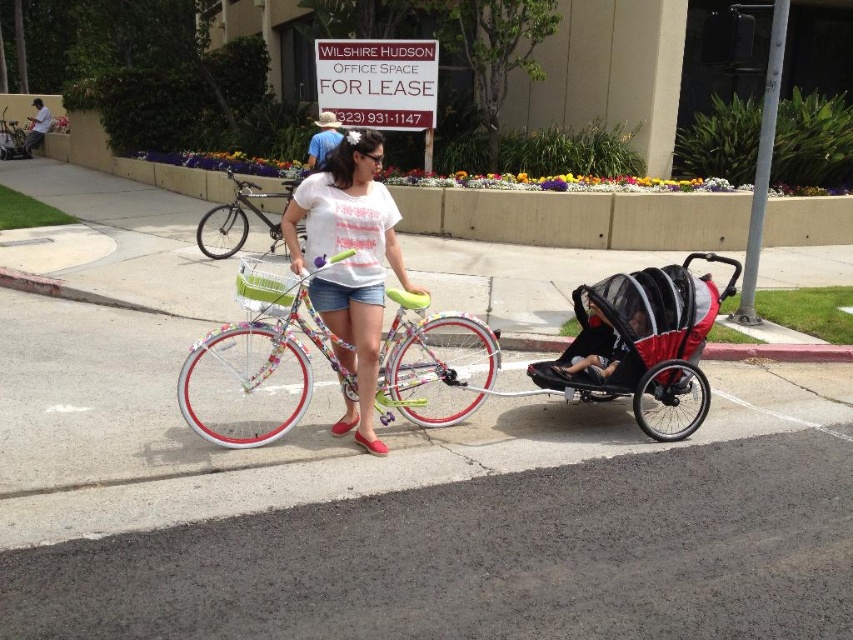
Between floral painted bicycle at center and metallic silver bicycle at center, which one has more height?

floral painted bicycle at center

Between point (380, 413) and point (242, 196), which one is positioned behind?

The point (242, 196) is behind.

Where is `floral painted bicycle at center`? floral painted bicycle at center is located at coordinates (270, 348).

Does black mesh baby carriage at center have a greater width compared to soft gray fabric stroller at center?

Yes.

Is point (671, 384) closer to viewer compared to point (598, 317)?

Yes, it is in front of point (598, 317).

Between point (672, 262) and point (599, 378), which one is positioned in front?

Point (599, 378) is more forward.

At what (x,y) coordinates should I click in order to perform the action: click on black mesh baby carriage at center. Please return your answer as a coordinate pair (x, y). The width and height of the screenshot is (853, 640). Looking at the image, I should click on (596, 346).

Between floral fabric shirt at center and metallic silver bicycle at left, which one appears on the right side from the viewer's perspective?

floral fabric shirt at center is more to the right.

Which is above, floral fabric shirt at center or metallic silver bicycle at left?

metallic silver bicycle at left is above.

Locate an element on the screen. floral fabric shirt at center is located at coordinates coord(350,262).